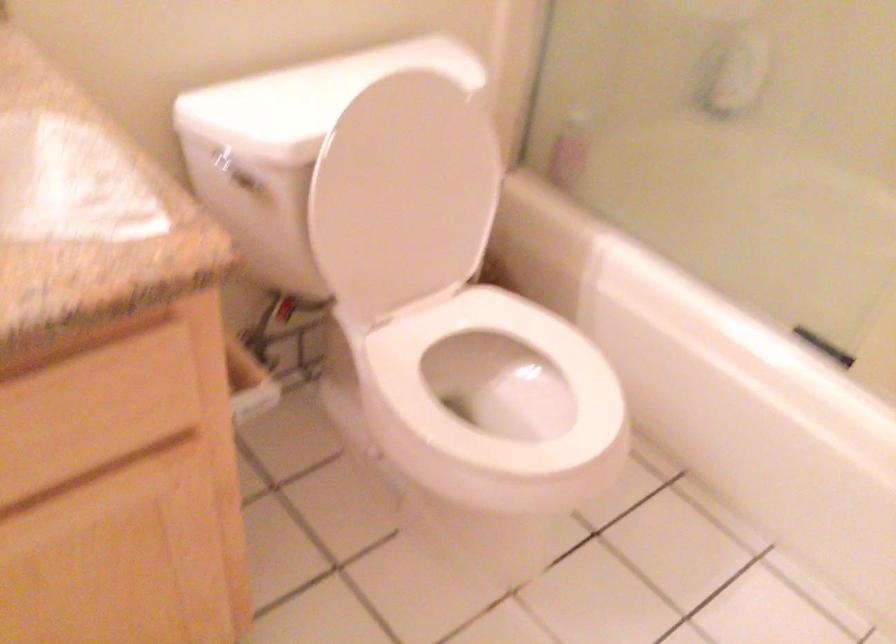
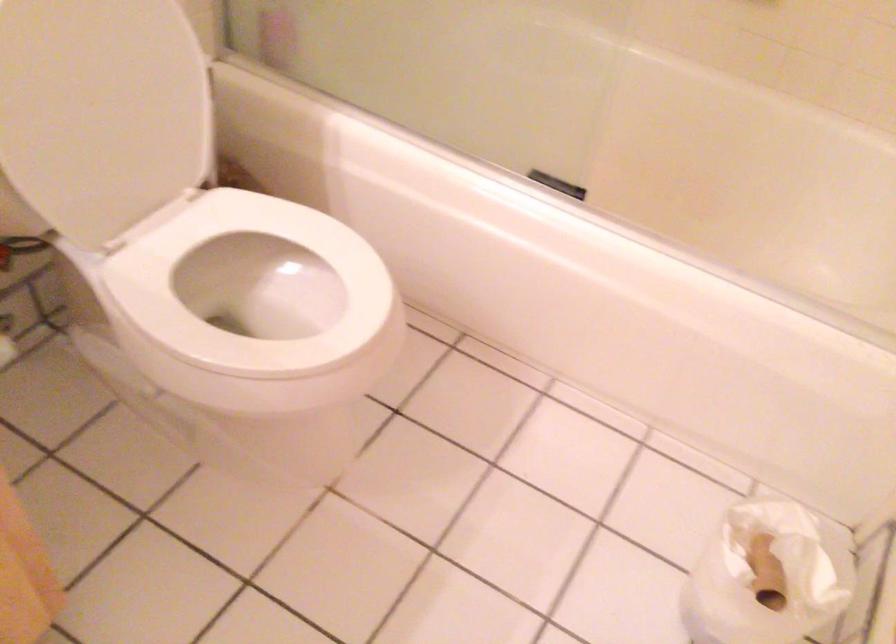
In a continuous first-person perspective shot, in which direction is the camera moving?

The movement direction of the cameraman is right, forward.